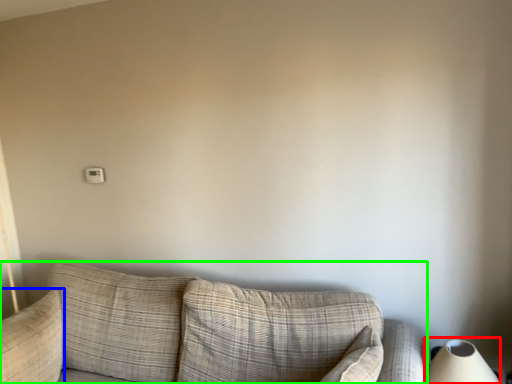
Question: Which is nearer to the table lamp (highlighted by a red box)? pillow (highlighted by a blue box) or studio couch (highlighted by a green box).

Choices:
 (A) pillow
 (B) studio couch

Answer: (B)